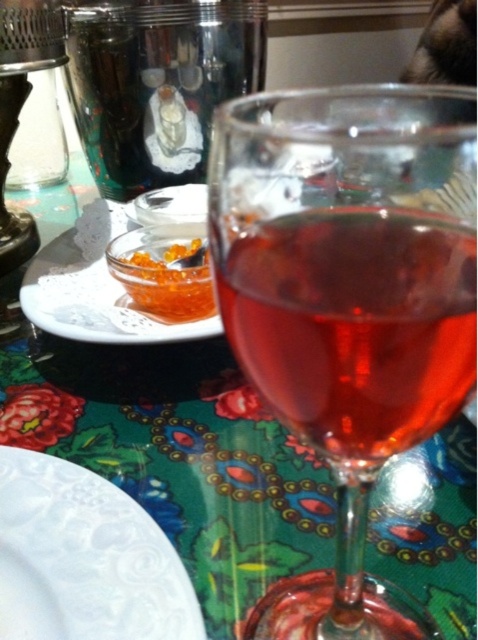
You are a guest at a dinner party and see the point marked at coordinates (347, 301) on the table. What object is located at that point?

The transparent glass wine glass at center is located at the point marked by coordinates (347, 301).

You are a waiter at a restaurant and need to place a decorative plate with orange caviar on the table. The table has a dark green floral tablecloth with red and blue flowers. Where should you place the plate so it doesn not block the view of the translucent glass wine at center?

The decorative plate should be placed away from the translucent glass wine at center, which is located at point (x=354, y=324). Placing the plate in another area of the table, such as near the edge or beside the glass, would ensure it doesn not obstruct the view of the glass.

You are a guest at a dinner party and want to reach for the orange caviar at center without disturbing the shiny metallic cup at upper left. Since the cup is in your way, can you easily move it to the side?

The shiny metallic cup at upper left is to the left of orange caviar at center, so you can move the shiny metallic cup at upper left to the left side further away from the orange caviar at center to access it without disturbance.